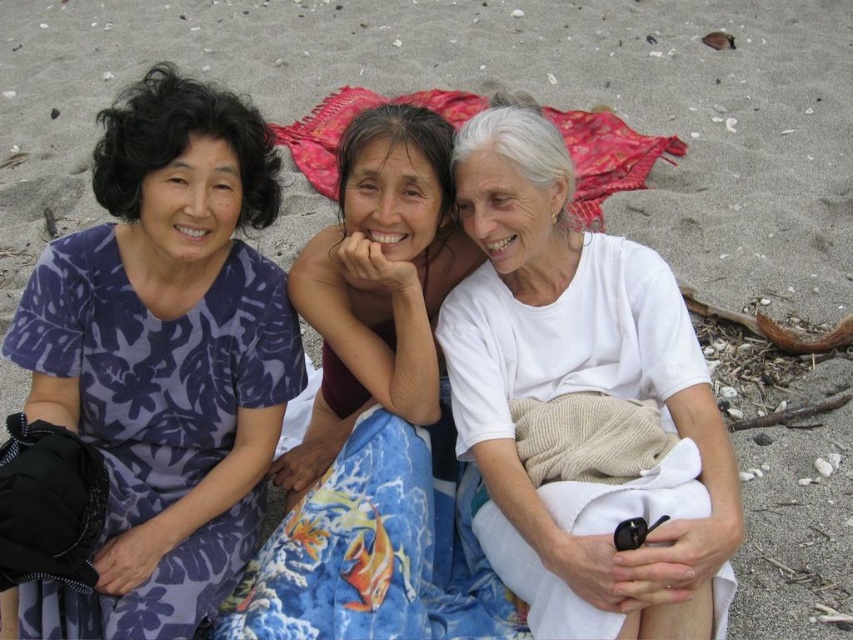
Question: Does white cotton shirt at center appear under red woven cloth at center?

Choices:
 (A) no
 (B) yes

Answer: (B)

Question: Is white cotton shirt at center thinner than red woven cloth at center?

Choices:
 (A) yes
 (B) no

Answer: (A)

Question: Based on their relative distances, which object is farther from the white cotton shirt at center?

Choices:
 (A) red woven cloth at center
 (B) matte floral dress at center
 (C) purple floral dress at left

Answer: (A)

Question: Which point is closer to the camera?

Choices:
 (A) red woven cloth at center
 (B) matte floral dress at center
 (C) purple floral dress at left

Answer: (C)

Question: Estimate the real-world distances between objects in this image. Which object is closer to the matte floral dress at center?

Choices:
 (A) white cotton shirt at center
 (B) red woven cloth at center

Answer: (A)

Question: Is white cotton shirt at center to the left of red woven cloth at center from the viewer's perspective?

Choices:
 (A) yes
 (B) no

Answer: (A)